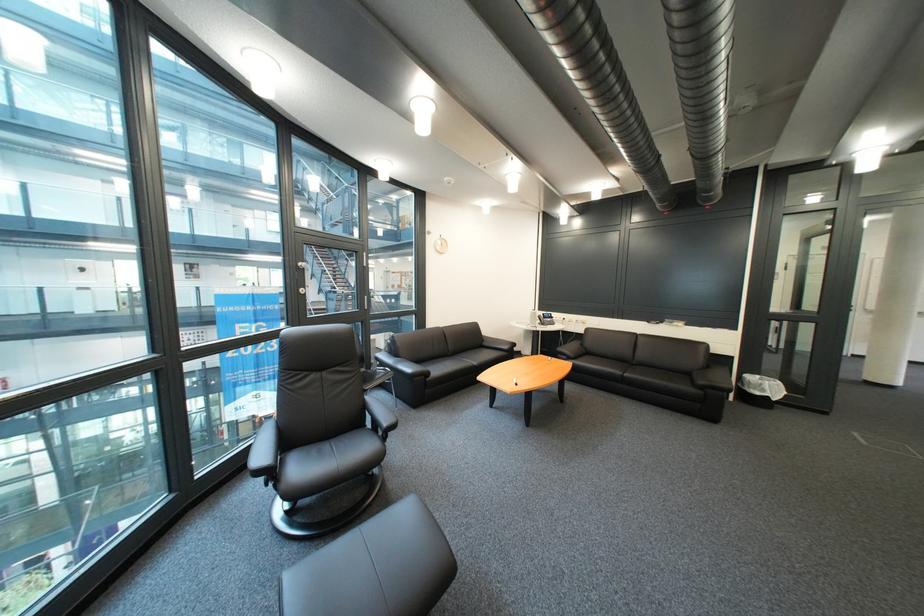
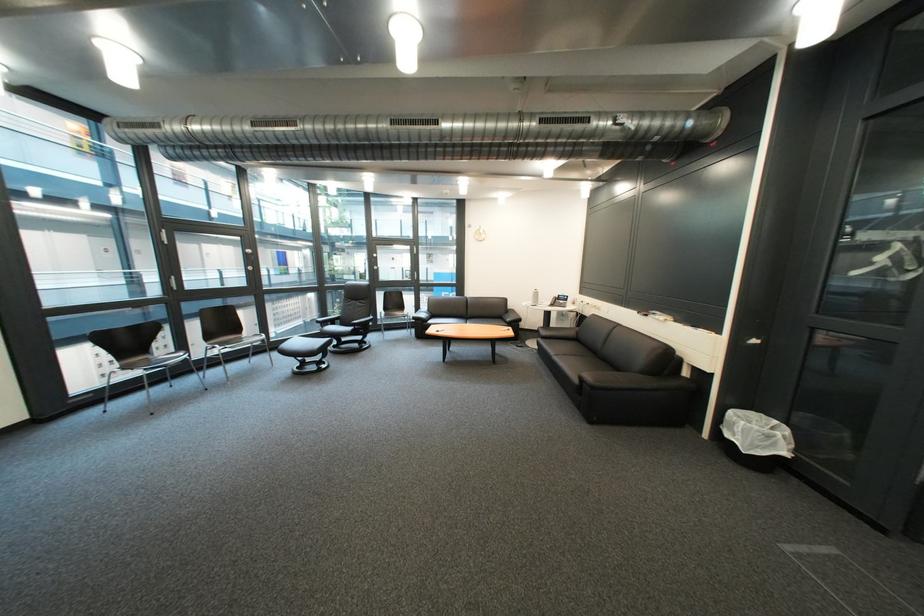
The point at (781, 389) is marked in the first image. Where is the corresponding point in the second image?

(751, 431)